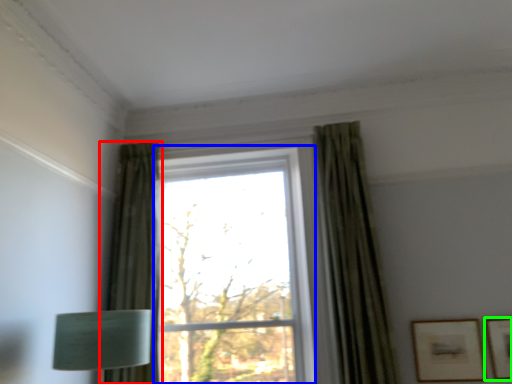
Question: Considering the real-world distances, which object is farthest from curtain (highlighted by a red box)? window (highlighted by a blue box) or picture frame (highlighted by a green box)?

Choices:
 (A) window
 (B) picture frame

Answer: (B)